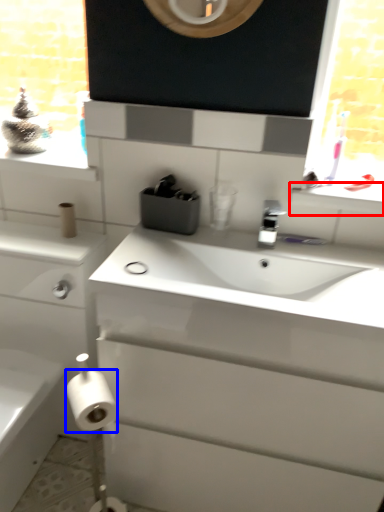
Question: Which object is further to the camera taking this photo, window sill (highlighted by a red box) or toilet paper (highlighted by a blue box)?

Choices:
 (A) window sill
 (B) toilet paper

Answer: (A)